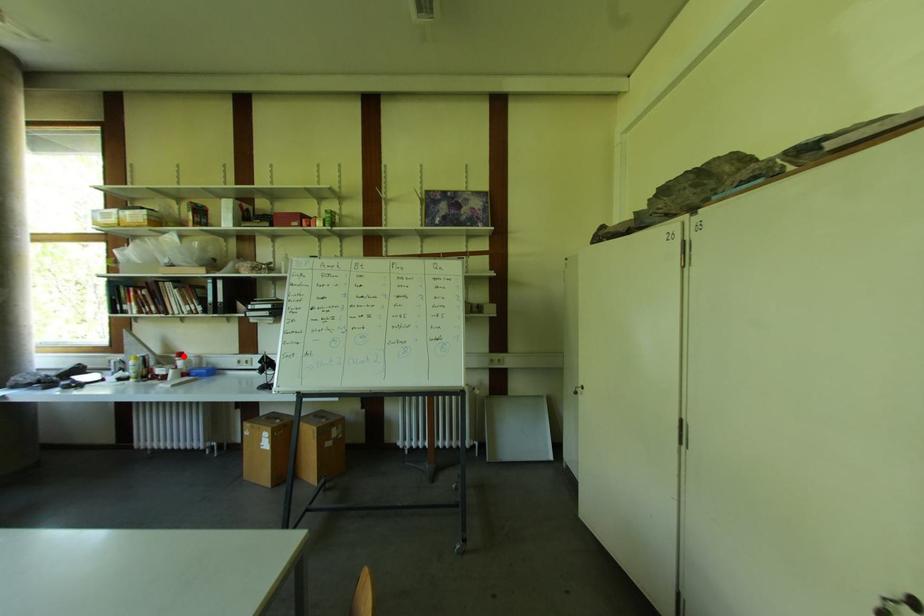
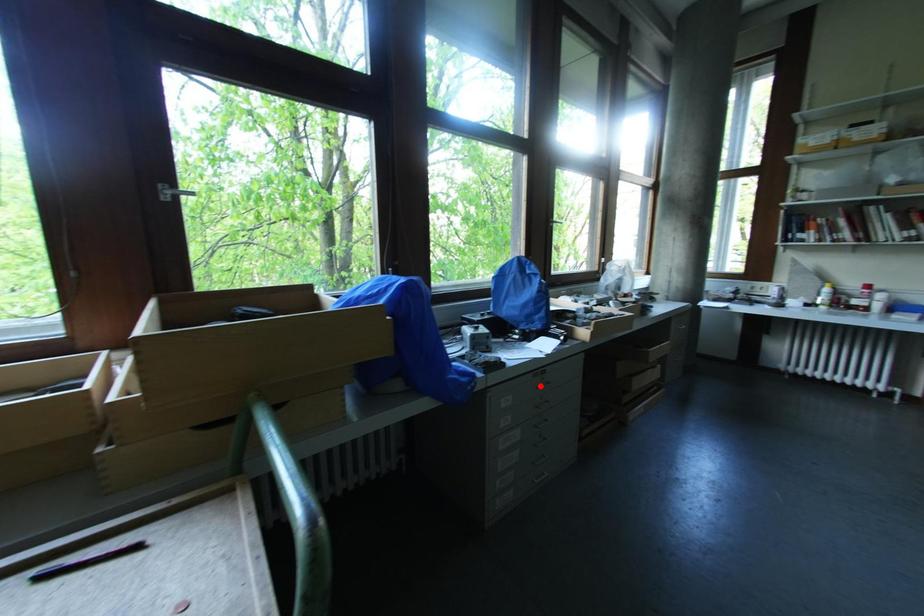
I am providing you with two images of the same scene from different viewpoints. A red point is marked on the first image and another point is marked on the second image. Is the red point in image1 aligned with the point shown in image2?

No